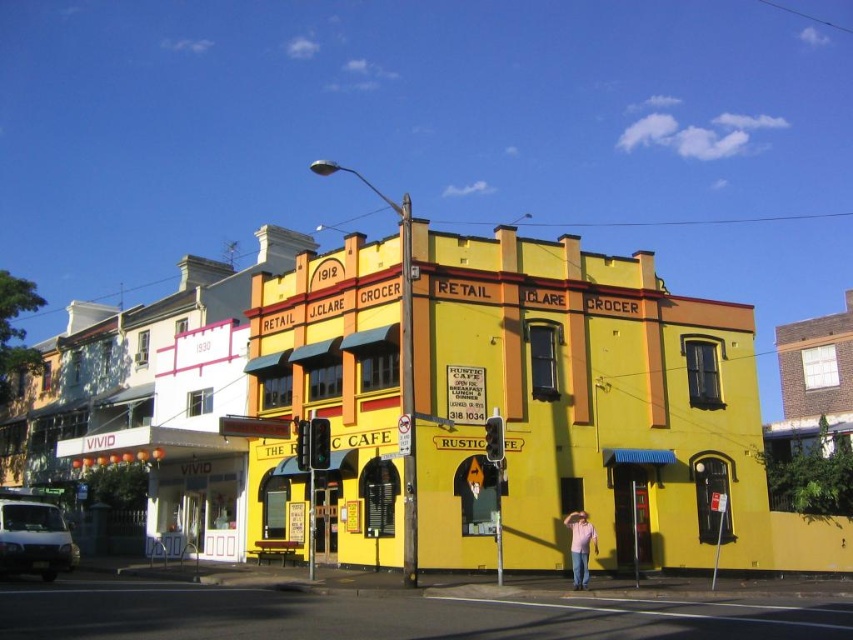
Which is more to the right, yellow matte building at center or pink cotton shirt at lower right?

pink cotton shirt at lower right is more to the right.

Which of these two, yellow matte building at center or pink cotton shirt at lower right, stands shorter?

With less height is pink cotton shirt at lower right.

What do you see at coordinates (577, 403) in the screenshot? I see `yellow matte building at center` at bounding box center [577, 403].

The width and height of the screenshot is (853, 640). I want to click on yellow matte building at center, so click(577, 403).